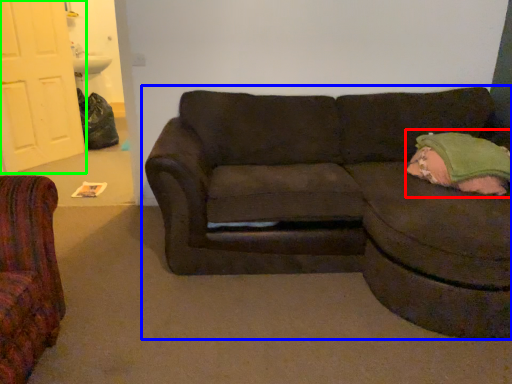
Question: Considering the real-world distances, which object is closest to pillow (highlighted by a red box)? studio couch (highlighted by a blue box) or door (highlighted by a green box).

Choices:
 (A) studio couch
 (B) door

Answer: (A)